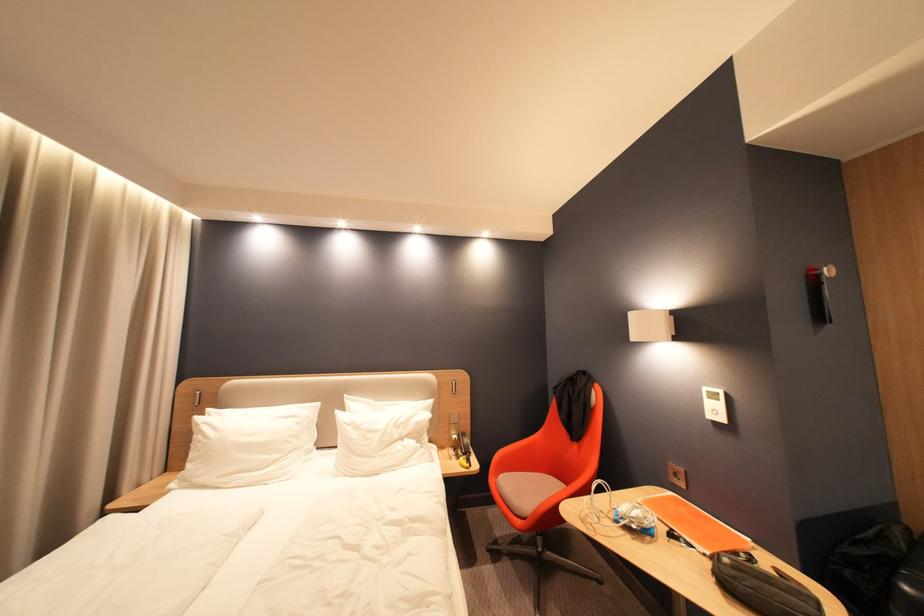
Where is `headboard switch`? This screenshot has width=924, height=616. headboard switch is located at coordinates (454, 402).